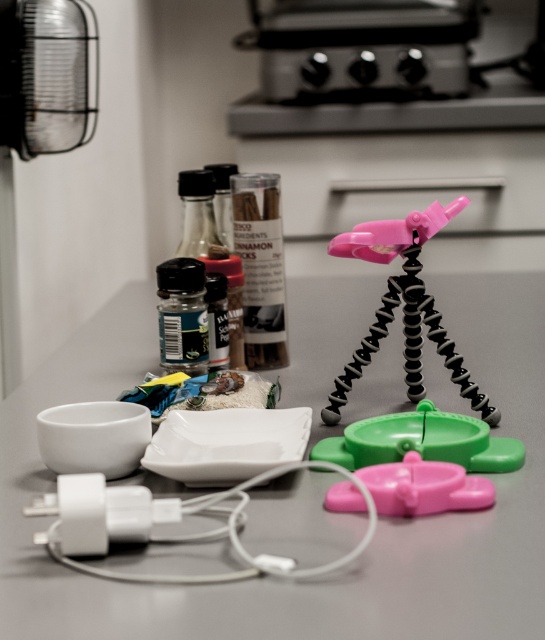
You are organizing the items on the countertop. You need to place a new item between the green plastic toy at center and the black glass spice at center. Where should you place it?

The green plastic toy at center is located below the black glass spice at center, so placing the new item between them would require positioning it either above the green plastic toy at center or below the black glass spice at center.

You are organizing the countertop and need to place a new item exactly at the center. Is the green plastic toy at center currently occupying that spot?

The green plastic toy at center is located at point (421, 442), which is not the exact center of the countertop. Therefore, it is not occupying the center spot.

You are organizing the kitchen counter and need to place the white plastic charger at lower left and the green matte spice bottle at center into a drawer. The drawer can only accommodate items that are narrower than 10 cm. Which item might not fit if the charger is 12 cm wide?

The white plastic charger at lower left might not fit in the drawer since it is wider than the green matte spice bottle at center, and if it is 12 cm wide, it exceeds the 10 cm limit.